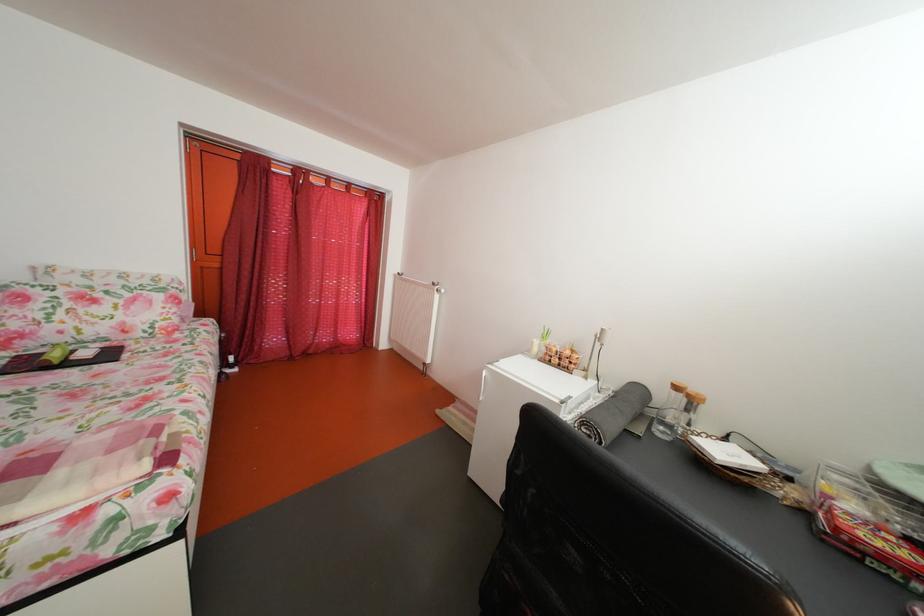
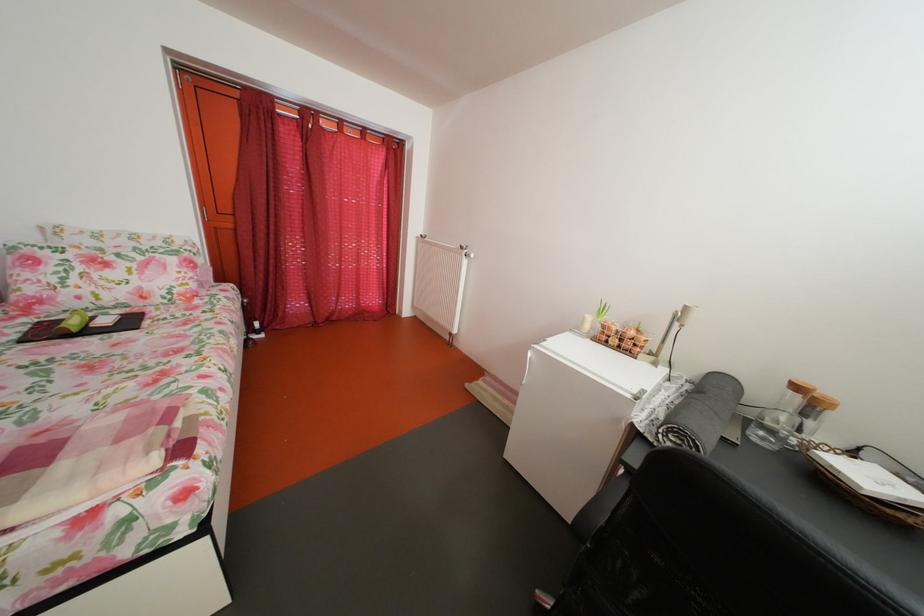
Locate, in the second image, the point that corresponds to (x=53, y=360) in the first image.

(73, 326)